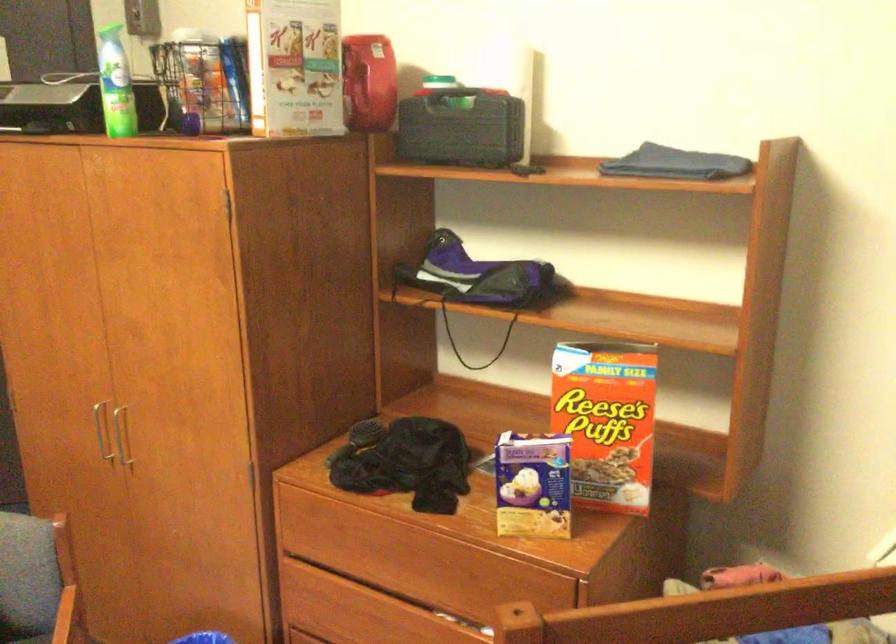
What do you see at coordinates (113, 53) in the screenshot?
I see `a spray can nozzle` at bounding box center [113, 53].